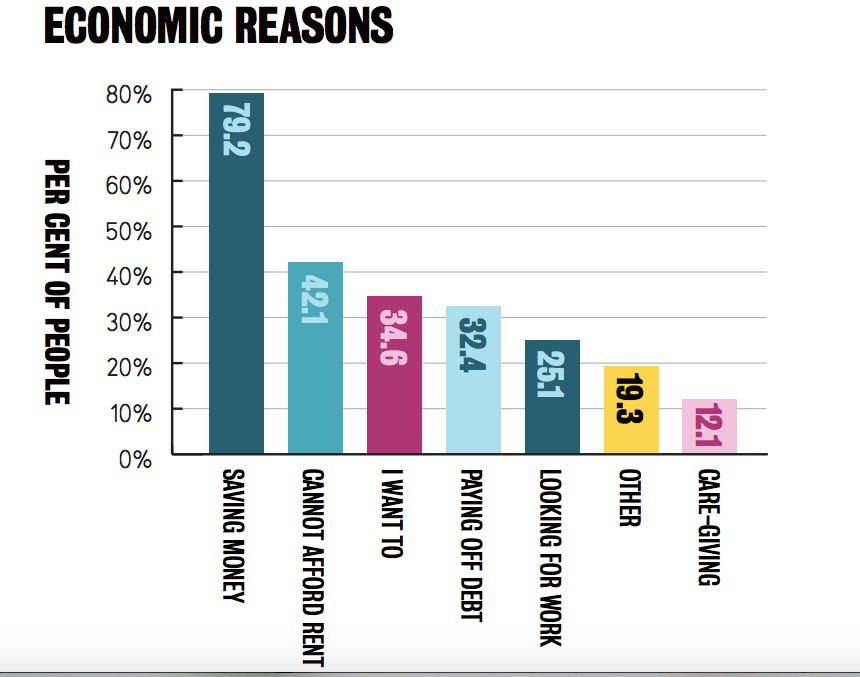
Locate an element on the screen. bar is located at coordinates (231, 305).